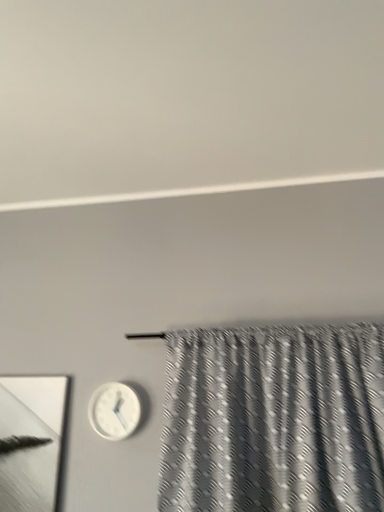
Describe the element at coordinates (114, 411) in the screenshot. I see `white plastic wall clock at lower left` at that location.

Locate an element on the screen. white plastic wall clock at lower left is located at coordinates (114, 411).

You are a GUI agent. You are given a task and a screenshot of the screen. Output one action in this format:
    pyautogui.click(x=<x>, y=<y>)
    Task: Click on the white plastic wall clock at lower left
    The width and height of the screenshot is (384, 512).
    Given the screenshot: What is the action you would take?
    pyautogui.click(x=114, y=411)